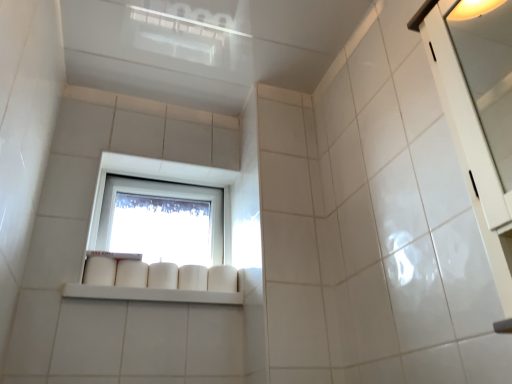
Find the location of a particular element. white glossy cabinet at right is located at coordinates (478, 111).

What is the approximate height of white glossy cabinet at right?

26.96 inches.

At what (x,y) coordinates should I click in order to perform the action: click on white glossy shelf at center. Please return your answer as a coordinate pair (x, y). This screenshot has height=384, width=512. Looking at the image, I should click on (153, 294).

In the image, is white glossy cabinet at right positioned in front of or behind transparent glass window at center?

In the image, white glossy cabinet at right appears in front of transparent glass window at center.

Which point is more forward, (510, 210) or (115, 246)?

The point (510, 210) is closer.

Is there a large distance between white glossy cabinet at right and transparent glass window at center?

Yes.

How many degrees apart are the facing directions of white glossy cabinet at right and transparent glass window at center?

The facing directions of white glossy cabinet at right and transparent glass window at center are 89.6 degrees apart.

You are a GUI agent. You are given a task and a screenshot of the screen. Output one action in this format:
    pyautogui.click(x=<x>, y=<y>)
    Task: Click on the window sill below the transparent glass window at center (from a real-world perspective)
    The width and height of the screenshot is (512, 384).
    Given the screenshot: What is the action you would take?
    pyautogui.click(x=153, y=294)

Who is bigger, transparent glass window at center or white glossy shelf at center?

With larger size is transparent glass window at center.

Is transparent glass window at center wider than white glossy shelf at center?

No.

Between transparent glass window at center and white glossy shelf at center, which one is positioned behind?

transparent glass window at center is further from the camera.

Is white glossy cabinet at right closer to camera compared to white glossy shelf at center?

Yes, it is in front of white glossy shelf at center.

Considering the sizes of white glossy cabinet at right and white glossy shelf at center in the image, is white glossy cabinet at right taller or shorter than white glossy shelf at center?

In the image, white glossy cabinet at right appears to be taller than white glossy shelf at center.

In terms of size, does white glossy cabinet at right appear bigger or smaller than white glossy shelf at center?

white glossy cabinet at right is bigger than white glossy shelf at center.

Between white glossy cabinet at right and white glossy shelf at center, which one has smaller width?

With smaller width is white glossy cabinet at right.

Considering the sizes of white glossy shelf at center and white glossy cabinet at right in the image, is white glossy shelf at center wider or thinner than white glossy cabinet at right?

white glossy shelf at center is wider than white glossy cabinet at right.

Is white glossy shelf at center positioned before white glossy cabinet at right?

No, it is not.

From a real-world perspective, is white glossy shelf at center located higher than white glossy cabinet at right?

No, from a real-world perspective, white glossy shelf at center is not above white glossy cabinet at right.

Between white glossy shelf at center and white glossy cabinet at right, which one appears on the left side from the viewer's perspective?

From the viewer's perspective, white glossy shelf at center appears more on the left side.

From a real-world perspective, is white glossy shelf at center physically above transparent glass window at center?

Incorrect, from a real-world perspective, white glossy shelf at center is lower than transparent glass window at center.

From the image's perspective, which is below, white glossy shelf at center or transparent glass window at center?

white glossy shelf at center.

Is white glossy shelf at center inside the boundaries of transparent glass window at center, or outside?

white glossy shelf at center lies outside transparent glass window at center.

Looking at their sizes, would you say transparent glass window at center is wider or thinner than white glossy cabinet at right?

In the image, transparent glass window at center appears to be more narrow than white glossy cabinet at right.

In the image, is transparent glass window at center on the left side or the right side of white glossy cabinet at right?

transparent glass window at center is to the left of white glossy cabinet at right.

Is transparent glass window at center next to white glossy cabinet at right and touching it?

No, transparent glass window at center is not touching white glossy cabinet at right.

Is transparent glass window at center spatially inside white glossy cabinet at right, or outside of it?

transparent glass window at center lies outside white glossy cabinet at right.

Identify the location of window below the white glossy cabinet at right (from the image's perspective). (162, 198).

The width and height of the screenshot is (512, 384). In order to click on window sill lying on the right of transparent glass window at center in this screenshot , I will do `click(153, 294)`.

Considering their positions, is white glossy cabinet at right positioned closer to white glossy shelf at center than transparent glass window at center?

transparent glass window at center.

Considering their positions, is white glossy shelf at center positioned further to white glossy cabinet at right than transparent glass window at center?

transparent glass window at center lies further to white glossy cabinet at right than the other object.

Looking at the image, which one is located closer to white glossy cabinet at right, transparent glass window at center or white glossy shelf at center?

Based on the image, white glossy shelf at center appears to be nearer to white glossy cabinet at right.

From the image, which object appears to be farther from transparent glass window at center, white glossy shelf at center or white glossy cabinet at right?

white glossy cabinet at right is positioned further to the anchor transparent glass window at center.

Based on their spatial positions, is transparent glass window at center or white glossy cabinet at right closer to white glossy shelf at center?

The object closer to white glossy shelf at center is transparent glass window at center.

From the image, which object appears to be nearer to transparent glass window at center, white glossy cabinet at right or white glossy shelf at center?

white glossy shelf at center is positioned closer to the anchor transparent glass window at center.

Find the location of a particular element. This screenshot has height=384, width=512. window sill between white glossy cabinet at right and transparent glass window at center from front to back is located at coordinates (153, 294).